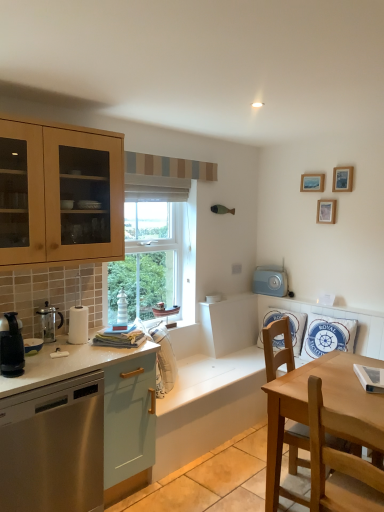
Question: Would you say blue fabric pillow at right, acting as the second pillow starting from the left, is inside or outside wooden picture frame at upper right, placed as the 2th picture frame when sorted from top to bottom?

Choices:
 (A) outside
 (B) inside

Answer: (A)

Question: From a real-world perspective, is blue fabric pillow at right, the 1th pillow when ordered from right to left, positioned above or below wooden picture frame at upper right, placed as the 2th picture frame when sorted from top to bottom?

Choices:
 (A) below
 (B) above

Answer: (A)

Question: Considering the real-world distances, which object is farthest from the white fabric pillow at right, acting as the second pillow starting from the right?

Choices:
 (A) white striped lighthouse at window, which is the second appliance from back to front
 (B) wooden chair at lower right, the 1th chair positioned from the front
 (C) wooden picture frame at upper right, placed as the first picture frame when sorted from bottom to top
 (D) black plastic coffee maker at left, the 1th kitchen appliance from the front
 (E) stainless steel dishwasher at left

Answer: (D)

Question: Estimate the real-world distances between objects in this image. Which object is closer to the black plastic coffee maker at left, the 1th kitchen appliance from the front?

Choices:
 (A) wooden picture frame at upper right, the second picture frame ordered from the bottom
 (B) wooden picture frame at upper right, arranged as the third picture frame when viewed from the top
 (C) wooden picture frame at upper right, arranged as the first picture frame when viewed from the top
 (D) blue fabric pillow at right, the 1th pillow when ordered from right to left
 (E) white glossy countertop at lower left

Answer: (E)